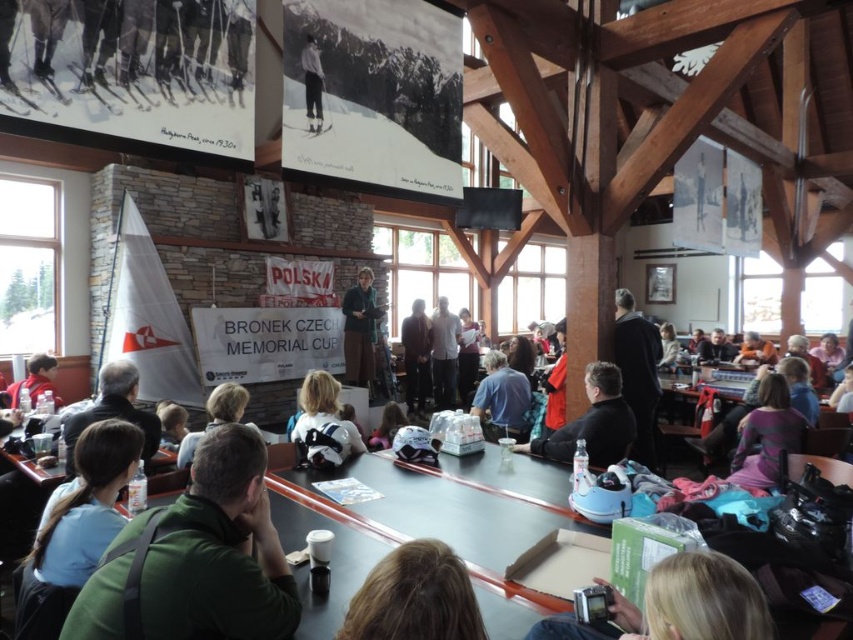
You are attending a presentation at the ski lodge and notice two items on the table in front of you. Which one is closer to you between the green matte shirt at center and the dark blue jacket at center?

The green matte shirt at center is closer to you because it is positioned under the dark blue jacket at center, meaning it is lower and nearer in the arrangement.

You are sitting at the long table in the ski lodge and want to hand a document to the person with dark brown hair at center. The dark brown leather jacket at center is in your way. Can you move the jacket to reach the person?

The dark brown leather jacket at center is to the right of dark brown hair at center, so moving the jacket to the right would allow you to reach the person with dark brown hair at center.

You are a photographer standing at the back of the room. You want to take a photo of the blonde hair at lower center and the dark blue jacket at center so that both are clearly visible. Which object should you focus on first to ensure proper focus?

The blonde hair at lower center should be focused on first since it is closer to the photographer than the dark blue jacket at center, ensuring both are in focus when using depth of field properly.